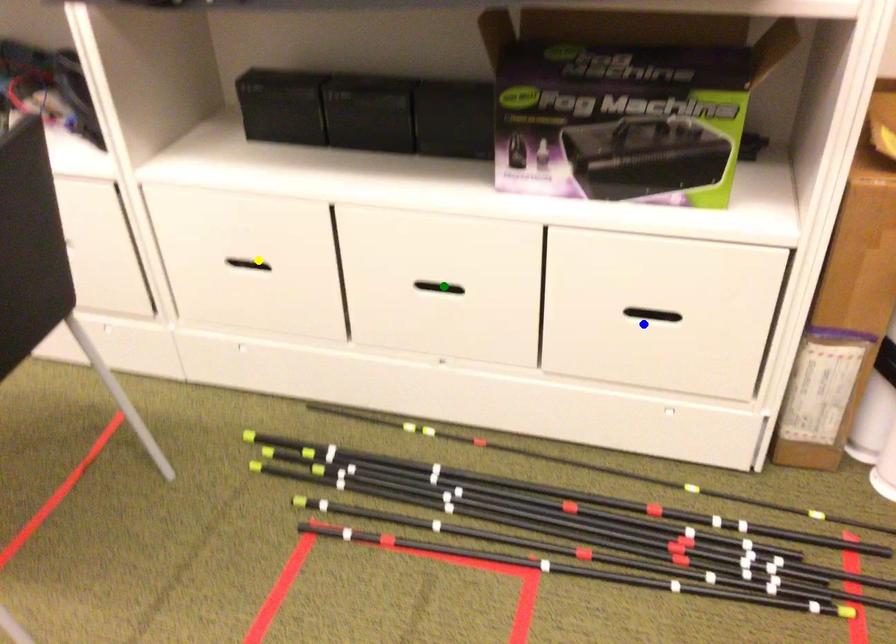
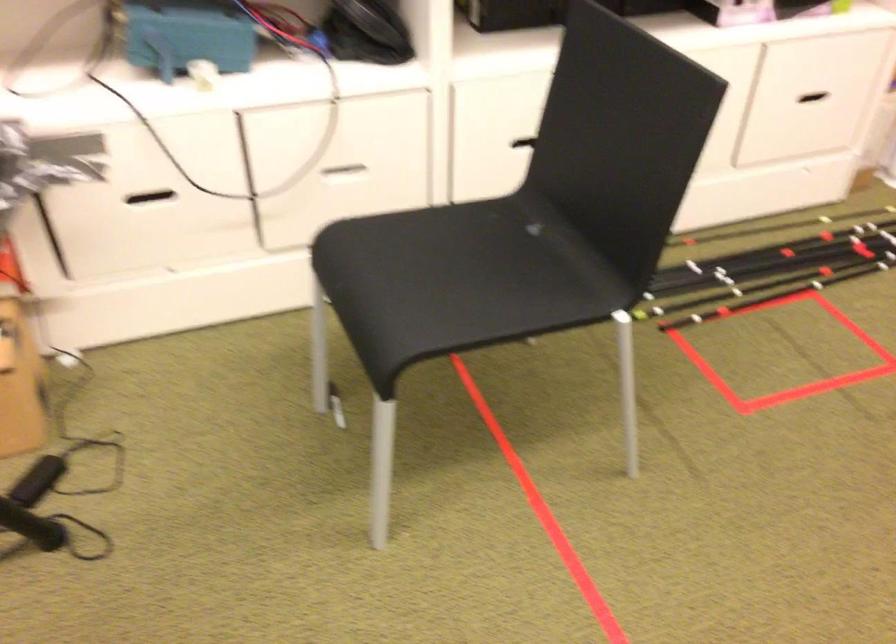
I am providing you with two images of the same scene from different viewpoints. Three points are marked in image1. Which point corresponds to a part or object that is occluded in image2?In image1, three points are marked. Which of them correspond to a part or object that is occluded in image2?Among the three points shown in image1, which one corresponds to a part or object that is no longer visible due to occlusion in image2?

Invisible in image2: yellow point, green point.